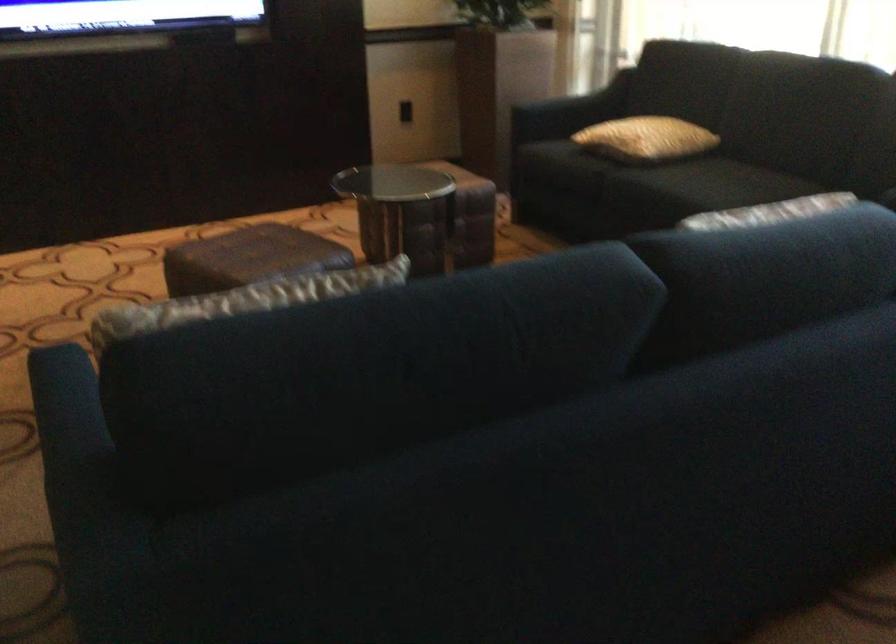
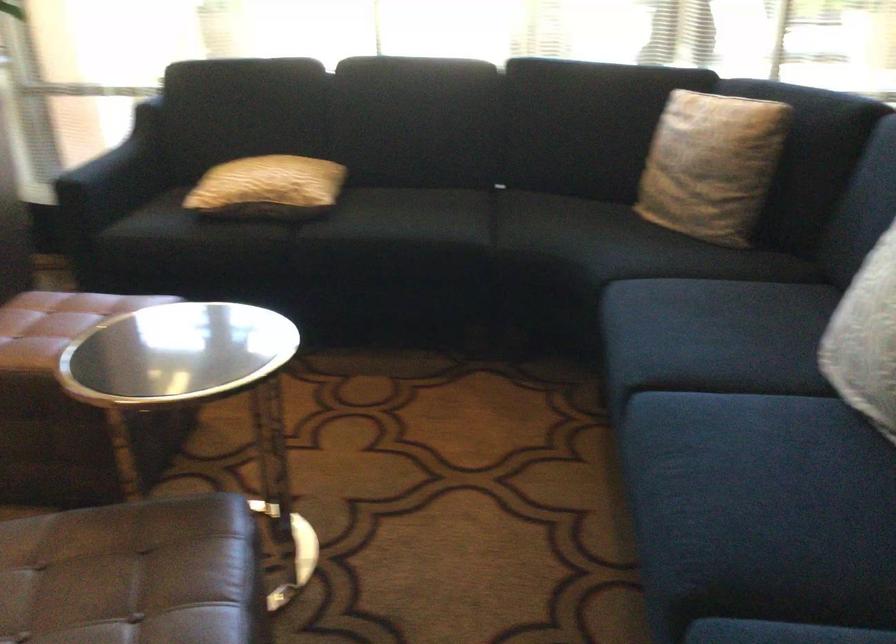
Locate, in the second image, the point that corresponds to point 276,257 in the first image.

(134, 574)